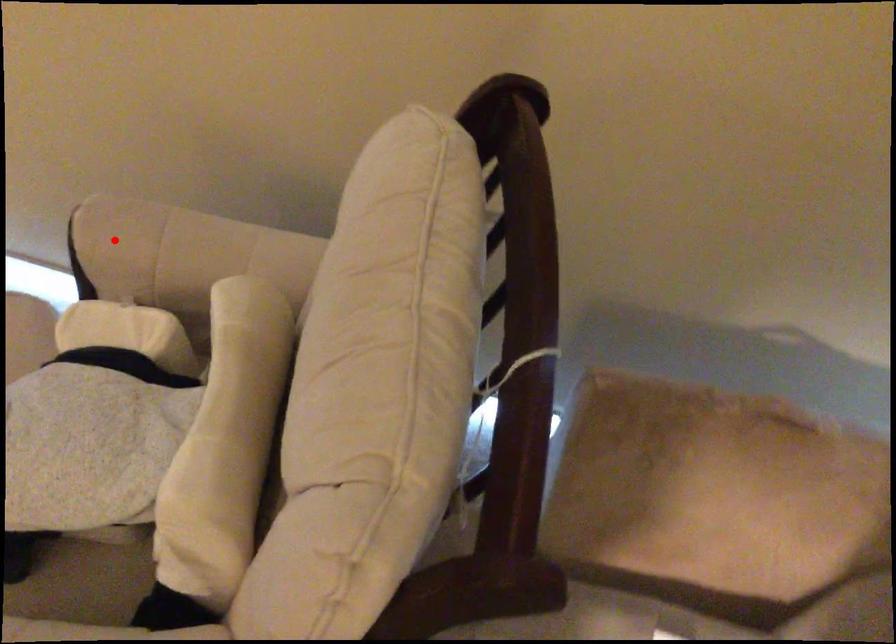
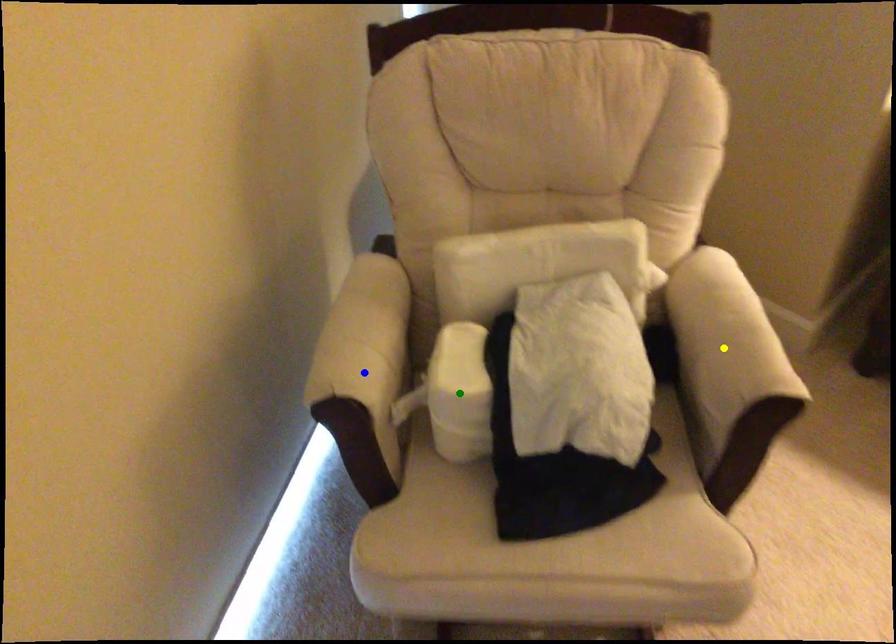
Question: I am providing you with two images of the same scene from different viewpoints. A red point is marked on the first image. You are given multiple points on the second image. Which point in image 2 represents the same 3d spot as the red point in image 1?

Choices:
 (A) yellow point
 (B) green point
 (C) blue point

Answer: (C)